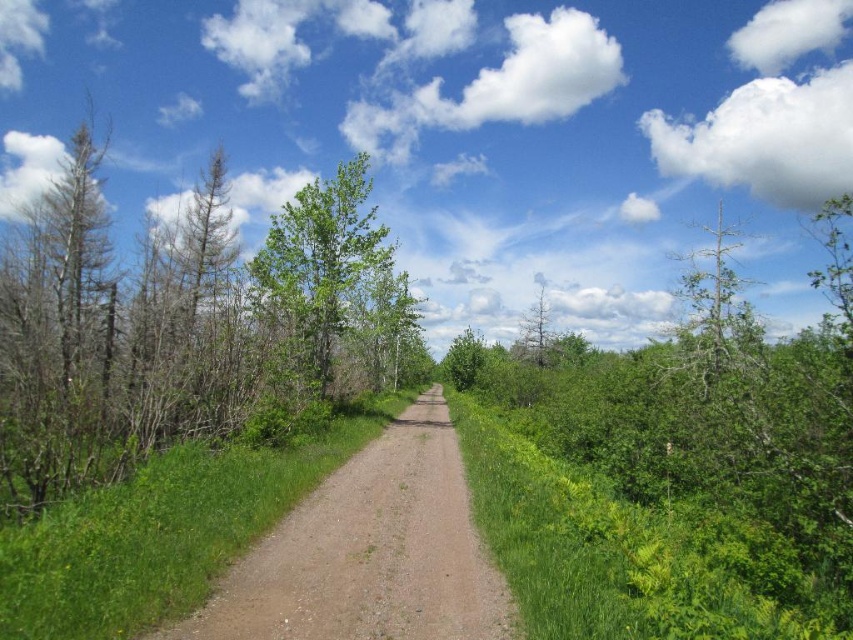
You are standing at the starting point of the dirt path in the rural scene. You see two points marked on the path ahead of you. The first point is at coordinates point (38, 369) and the second is at point (396, 588). If you walk straight along the path, which point will you encounter first?

You will encounter point (396, 588) first because point (38, 369) is behind it along the path.